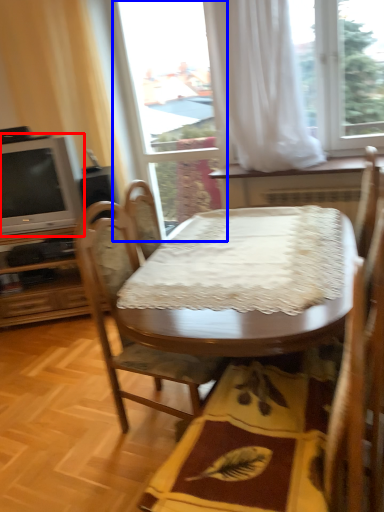
Question: Which point is closer to the camera, television (highlighted by a red box) or glass door (highlighted by a blue box)?

Choices:
 (A) television
 (B) glass door

Answer: (A)